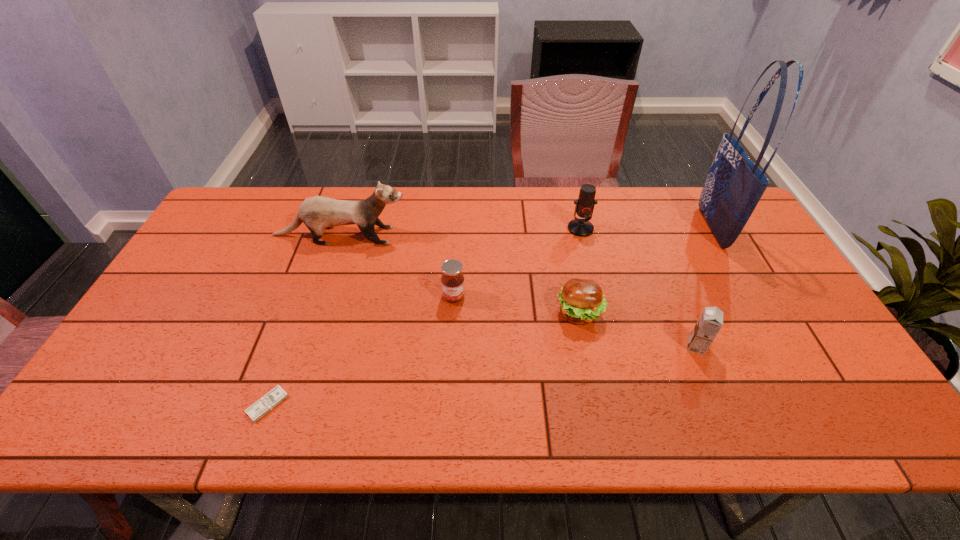
What are the coordinates of `vacant space that satisfies the following two spatial constraints: 1. on the back side of the second shortest object; 2. on the face of the second tallest object` in the screenshot? It's located at (564, 235).

At what (x,y) coordinates should I click in order to perform the action: click on free spot that satisfies the following two spatial constraints: 1. on the front side of the second nearest object; 2. on the left side of the second shortest object. Please return your answer as a coordinate pair (x, y). The width and height of the screenshot is (960, 540). Looking at the image, I should click on (587, 347).

Locate an element on the screen. blank space that satisfies the following two spatial constraints: 1. on the face of the second shortest object; 2. on the left side of the ferret is located at coordinates (315, 313).